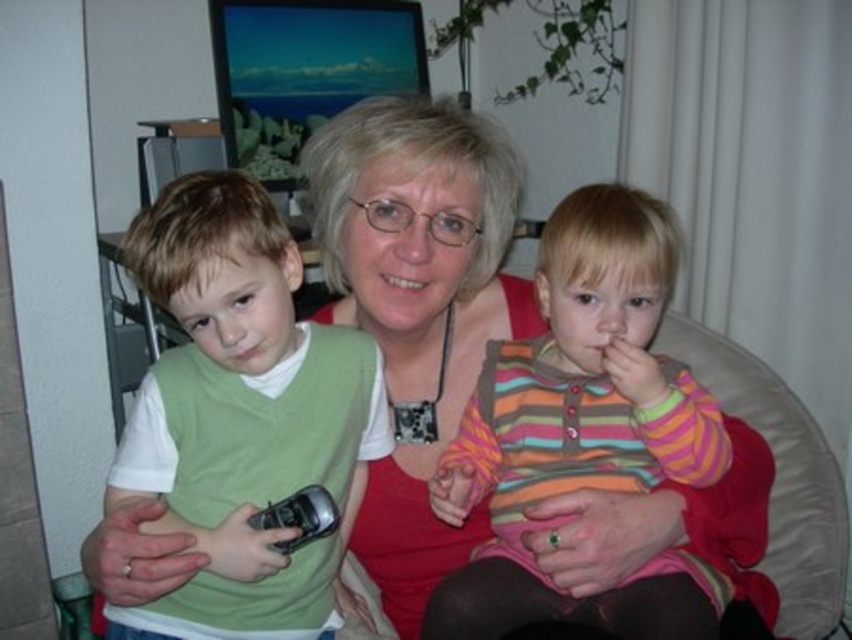
Where is the striped cotton shirt at center located in the image?

The striped cotton shirt at center is located at point 0.669 in the x coordinate and 0.684 in the y coordinate.

You are a photographer trying to capture a closeup of the striped cotton shirt at center and the green matte vest at left. Which one will appear larger in the photo?

The striped cotton shirt at center will appear larger in the photo because it is closer to the viewer than the green matte vest at left.